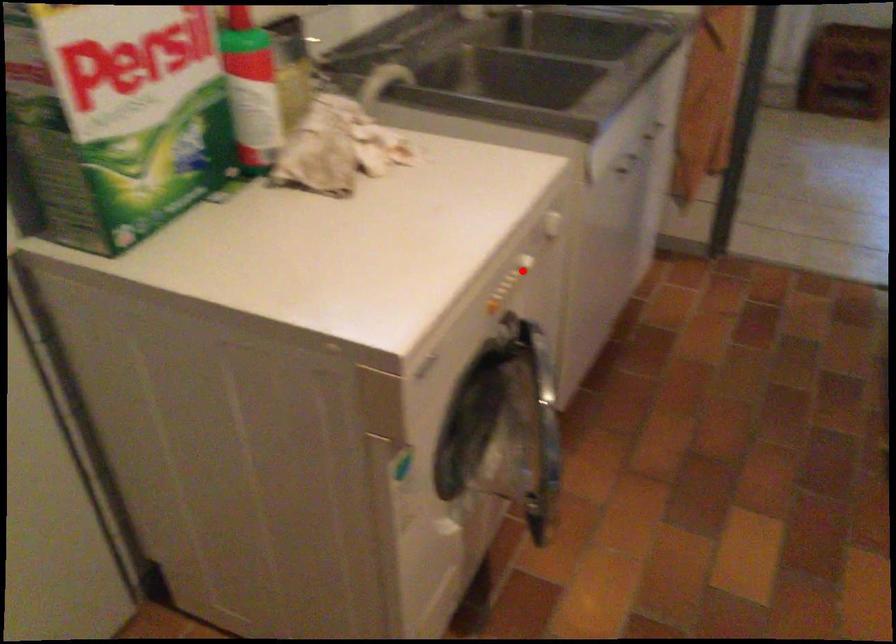
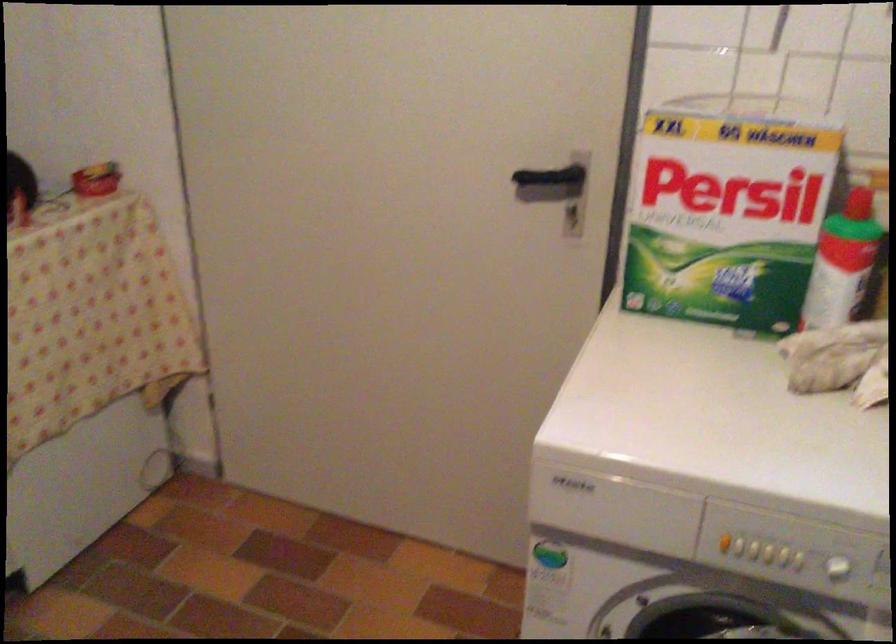
Find the pixel in the second image that matches the highlighted location in the first image.

(843, 574)